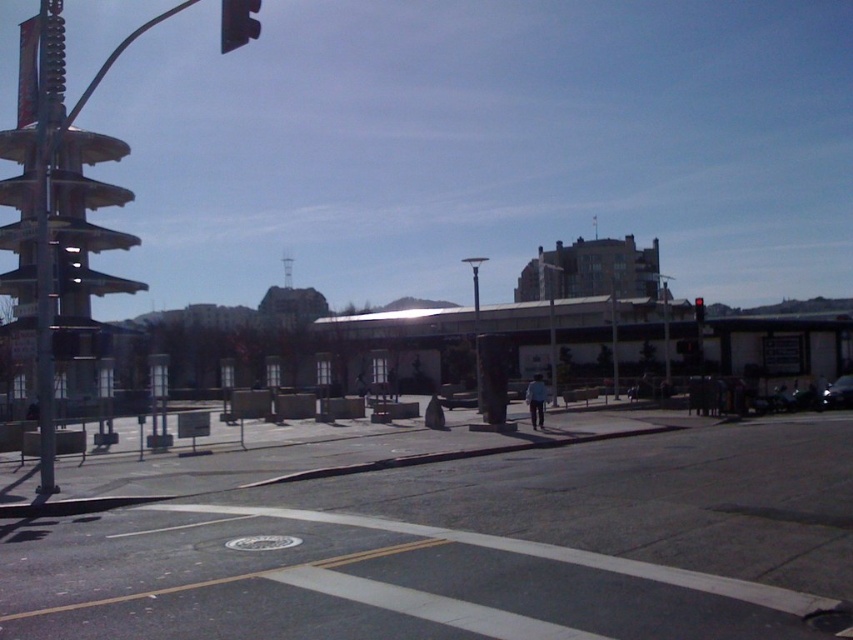
You are a city planner assessing the visibility of traffic lights in the urban scene. Considering the sizes of the black plastic traffic light at upper left and the red matte traffic light at center, which one might be more visible to drivers approaching the intersection?

The black plastic traffic light at upper left is larger in size than the red matte traffic light at center, so it might be more visible to drivers approaching the intersection.

You are driving a car and see the shiny black car at lower right and the red matte traffic light at center. Which object is closer to you?

The shiny black car at lower right is closer to you than the red matte traffic light at center because the traffic light is positioned behind the car.

You are driving a car and see the shiny black car at lower right and the red matte traffic light at center. Which object is positioned lower in the image?

The shiny black car at lower right is positioned lower than the red matte traffic light at center.